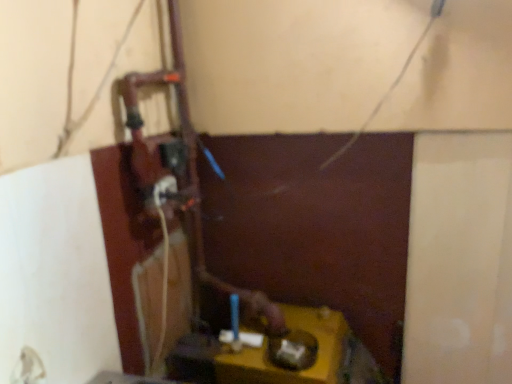
The width and height of the screenshot is (512, 384). Find the location of `free point above yellow matte table at lower center (from a real-world perspective)`. free point above yellow matte table at lower center (from a real-world perspective) is located at coordinates tap(301, 340).